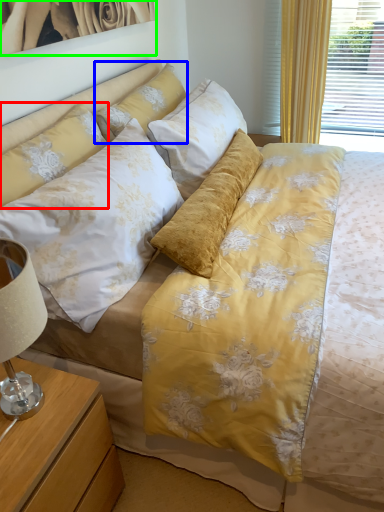
Question: Considering the real-world distances, which object is farthest from pillow (highlighted by a red box)? pillow (highlighted by a blue box) or picture frame (highlighted by a green box)?

Choices:
 (A) pillow
 (B) picture frame

Answer: (B)